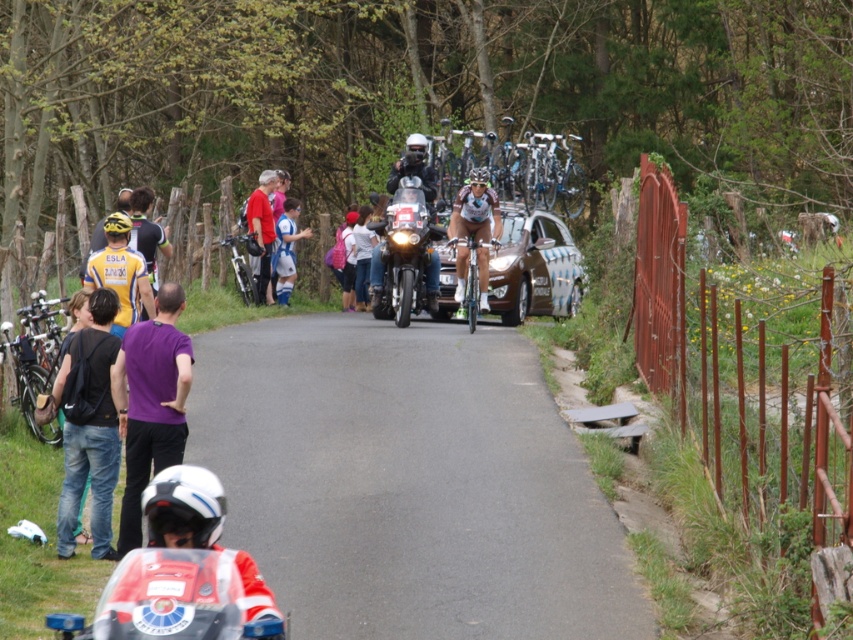
Does asphalt road at center appear over shiny black motorcycle at center?

No.

Who is taller, asphalt road at center or shiny black motorcycle at center?

With more height is shiny black motorcycle at center.

Image resolution: width=853 pixels, height=640 pixels. I want to click on asphalt road at center, so click(408, 481).

Is point (128, 260) positioned after point (469, 189)?

No, it is in front of (469, 189).

Measure the distance between yellow matte jersey at left and shiny blue cycling suit at center.

6.64 meters

Which is behind, point (115, 273) or point (468, 221)?

The point (468, 221) is behind.

This screenshot has height=640, width=853. I want to click on yellow matte jersey at left, so click(120, 273).

Measure the distance from asphalt road at center to yellow matte jersey at left.

7.79 feet

Can you confirm if asphalt road at center is positioned to the right of yellow matte jersey at left?

Correct, you'll find asphalt road at center to the right of yellow matte jersey at left.

Is point (329, 404) closer to viewer compared to point (117, 314)?

That is False.

Where is `asphalt road at center`? This screenshot has height=640, width=853. asphalt road at center is located at coordinates (408, 481).